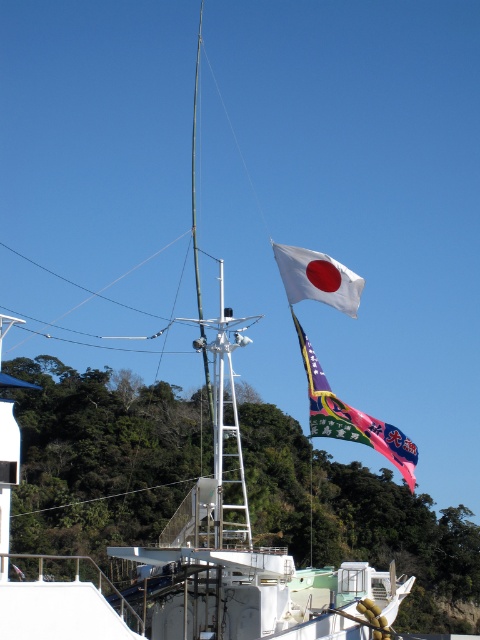
Who is positioned more to the right, white fabric flag at upper right or white fabric flag at upper center?

white fabric flag at upper right is more to the right.

Can you confirm if white fabric flag at upper right is bigger than white fabric flag at upper center?

Correct, white fabric flag at upper right is larger in size than white fabric flag at upper center.

Locate an element on the screen. The height and width of the screenshot is (640, 480). white fabric flag at upper right is located at coordinates (351, 417).

Image resolution: width=480 pixels, height=640 pixels. What are the coordinates of `white fabric flag at upper right` in the screenshot? It's located at (351, 417).